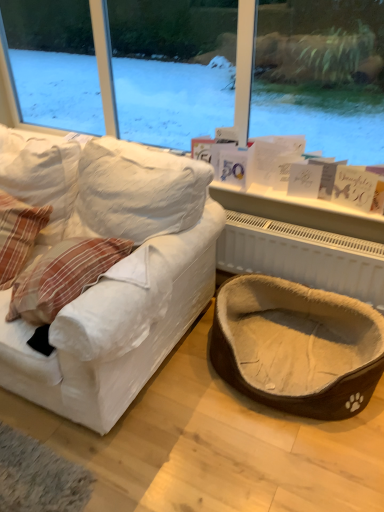
Locate an element on the screen. Image resolution: width=384 pixels, height=512 pixels. free space in front of brown fuzzy pet bed at lower right is located at coordinates (276, 463).